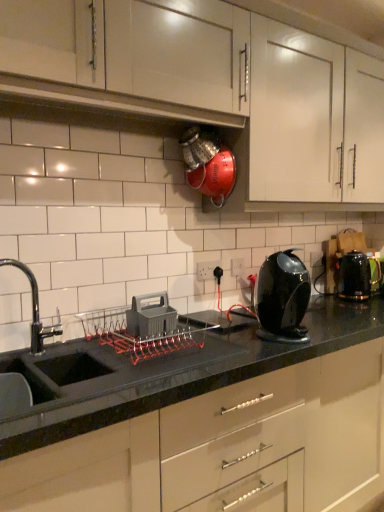
Where is `vacant space in glossy black kettle at center-right (from a real-world perspective)`? This screenshot has height=512, width=384. vacant space in glossy black kettle at center-right (from a real-world perspective) is located at coordinates (280, 338).